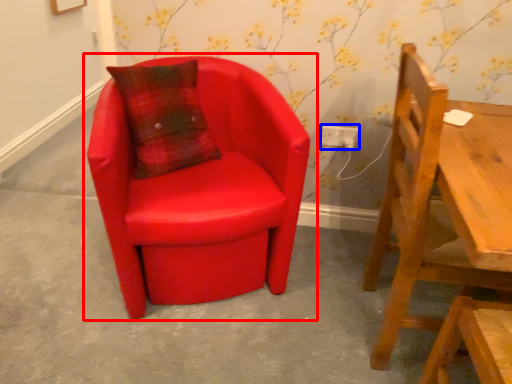
Question: Which object is closer to the camera taking this photo, chair (highlighted by a red box) or electric outlet (highlighted by a blue box)?

Choices:
 (A) chair
 (B) electric outlet

Answer: (A)